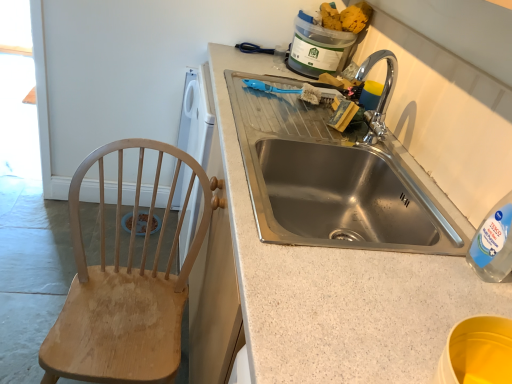
Question: Can you confirm if yellow sponge at upper right is taller than stainless steel sink at center?

Choices:
 (A) yes
 (B) no

Answer: (B)

Question: From a real-world perspective, is yellow sponge at upper right positioned under stainless steel sink at center based on gravity?

Choices:
 (A) yes
 (B) no

Answer: (B)

Question: Can stainless steel sink at center be found inside yellow sponge at upper right?

Choices:
 (A) yes
 (B) no

Answer: (B)

Question: Can you confirm if yellow sponge at upper right is bigger than stainless steel sink at center?

Choices:
 (A) no
 (B) yes

Answer: (A)

Question: Is yellow sponge at upper right completely or partially outside of stainless steel sink at center?

Choices:
 (A) no
 (B) yes

Answer: (B)

Question: Is stainless steel sink at center situated inside yellow sponge at upper right or outside?

Choices:
 (A) inside
 (B) outside

Answer: (B)

Question: Is point (271, 147) closer or farther from the camera than point (368, 4)?

Choices:
 (A) closer
 (B) farther

Answer: (A)

Question: Is stainless steel sink at center bigger or smaller than yellow sponge at upper right?

Choices:
 (A) big
 (B) small

Answer: (A)

Question: From a real-world perspective, is stainless steel sink at center physically located above or below yellow sponge at upper right?

Choices:
 (A) above
 (B) below

Answer: (B)

Question: Is yellow sponge at upper right wider or thinner than wooden chair at left?

Choices:
 (A) thin
 (B) wide

Answer: (A)

Question: From the image's perspective, relative to wooden chair at left, is yellow sponge at upper right above or below?

Choices:
 (A) below
 (B) above

Answer: (B)

Question: Considering the positions of yellow sponge at upper right and wooden chair at left in the image, is yellow sponge at upper right taller or shorter than wooden chair at left?

Choices:
 (A) tall
 (B) short

Answer: (B)

Question: Is yellow sponge at upper right inside the boundaries of wooden chair at left, or outside?

Choices:
 (A) outside
 (B) inside

Answer: (A)

Question: Which is correct: stainless steel sink at center is inside granite countertop at center, or outside of it?

Choices:
 (A) outside
 (B) inside

Answer: (B)

Question: Would you say stainless steel sink at center is to the left or to the right of granite countertop at center in the picture?

Choices:
 (A) left
 (B) right

Answer: (B)